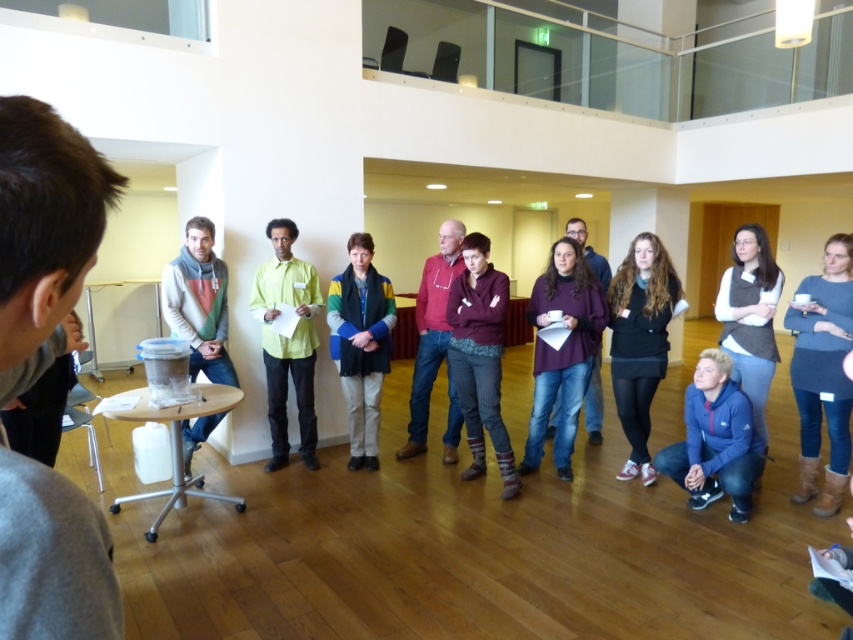
You are standing at the entrance of the office and see two people in the center area wearing a black knit sweater at center and a green matte shirt at center. Which one is positioned more to the left?

The green matte shirt at center is positioned more to the left because the black knit sweater at center is to the right of it.

In the scene shown: You are an event planner arranging chairs for a meeting. You have two attendees wearing the dark gray sweater at center and the multicolored fabric jacket at center. If you need to seat them side by side with equal space between each chair, which attendee requires a wider chair?

The multicolored fabric jacket at center requires a wider chair because its width is greater than the dark gray sweater at center.